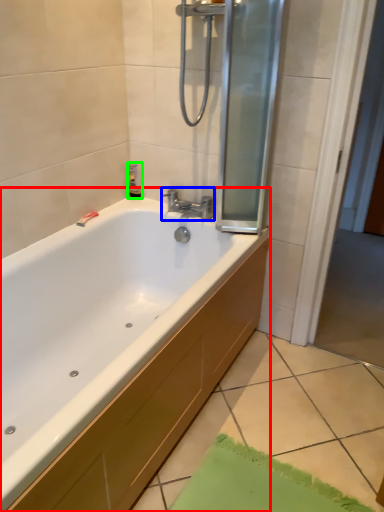
Question: Which object is positioned farthest from bathtub (highlighted by a red box)? Select from tap (highlighted by a blue box) and toiletry (highlighted by a green box).

Choices:
 (A) tap
 (B) toiletry

Answer: (B)